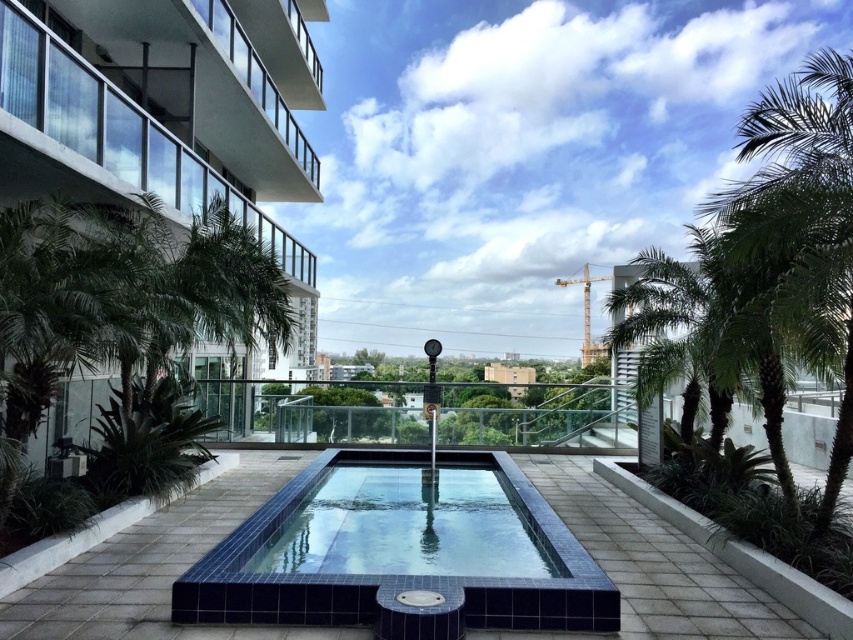
You are on the glassy concrete balcony at upper left and want to jump into the blue tile swimming pool at center. Is the balcony above the pool?

Yes, the glassy concrete balcony at upper left is above the blue tile swimming pool at center, so jumping from the balcony would land you in the pool.

You are standing on the rooftop and want to take a photo of the rectangular swimming pool. Where should you position yourself to ensure the glassy concrete balcony at upper left is not blocking the view of the pool?

To avoid the glassy concrete balcony at upper left blocking the view, position yourself away from the upper left area since the balcony is located there.